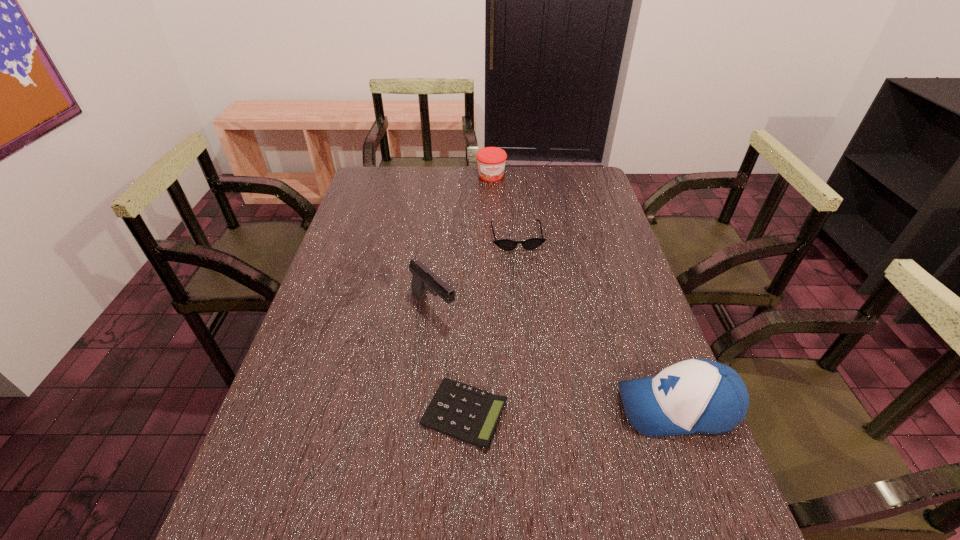
Find the location of a particular element. vacant space located 0.200m on the front-facing side of the rightmost object is located at coordinates (528, 408).

Where is `free space located on the front-facing side of the sunglasses`? The height and width of the screenshot is (540, 960). free space located on the front-facing side of the sunglasses is located at coordinates (531, 302).

I want to click on vacant space located 0.320m on the front-facing side of the sunglasses, so click(537, 326).

You are a GUI agent. You are given a task and a screenshot of the screen. Output one action in this format:
    pyautogui.click(x=<x>, y=<y>)
    Task: Click on the vacant space located 0.370m on the front-facing side of the sunglasses
    This screenshot has width=960, height=540.
    Given the screenshot: What is the action you would take?
    (540, 341)

Find the location of a particular element. The image size is (960, 540). blank area located 0.160m aim along the barrel of the third farthest object is located at coordinates (487, 360).

What are the coordinates of `vacant space located 0.120m aim along the barrel of the third farthest object` in the screenshot? It's located at (477, 350).

This screenshot has height=540, width=960. I want to click on vacant point located aim along the barrel of the third farthest object, so click(x=462, y=336).

Locate an element on the screen. vacant space located on the label side of the jam is located at coordinates (500, 200).

I want to click on free location located 0.120m on the label side of the jam, so click(x=500, y=200).

You are a GUI agent. You are given a task and a screenshot of the screen. Output one action in this format:
    pyautogui.click(x=<x>, y=<y>)
    Task: Click on the vacant region located 0.200m on the label side of the jam
    This screenshot has width=960, height=540.
    Given the screenshot: What is the action you would take?
    pyautogui.click(x=504, y=212)